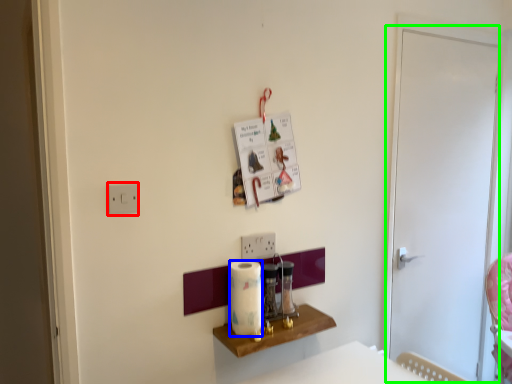
Question: Which object is positioned farthest from light switch (highlighted by a red box)? Select from paper towel (highlighted by a blue box) and screen door (highlighted by a green box).

Choices:
 (A) paper towel
 (B) screen door

Answer: (B)